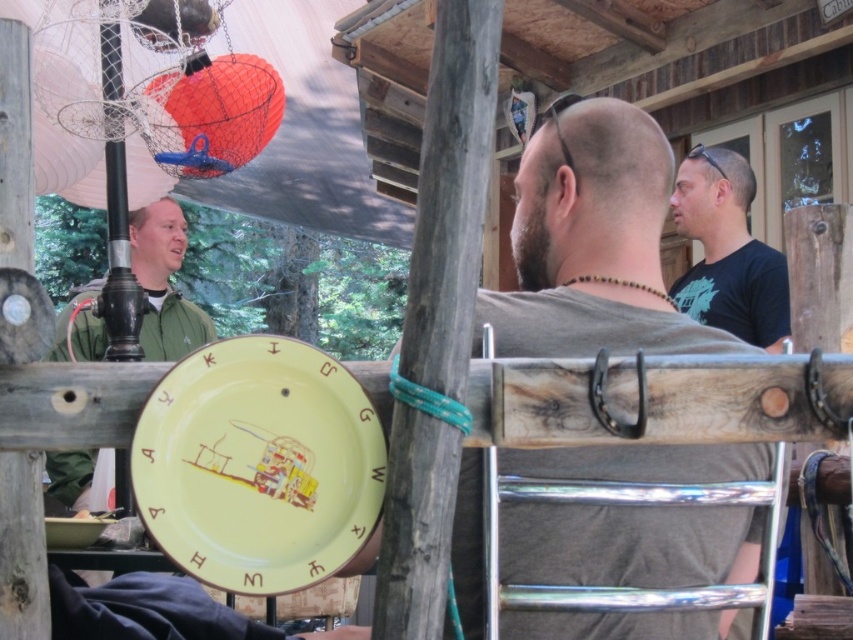
Can you confirm if black matte t-shirt at upper right is wider than green matte jacket at left?

No.

Which of these two, black matte t-shirt at upper right or green matte jacket at left, stands taller?

black matte t-shirt at upper right is taller.

You are a GUI agent. You are given a task and a screenshot of the screen. Output one action in this format:
    pyautogui.click(x=<x>, y=<y>)
    Task: Click on the black matte t-shirt at upper right
    This screenshot has height=640, width=853.
    Given the screenshot: What is the action you would take?
    pyautogui.click(x=727, y=252)

Between point (694, 352) and point (77, 522), which one is positioned behind?

The point (77, 522) is more distant.

Which is in front, point (552, 627) or point (86, 534)?

Positioned in front is point (552, 627).

Is point (523, 474) positioned in front of point (57, 545)?

Yes, it is.

The height and width of the screenshot is (640, 853). Identify the location of gray fabric shirt at center. click(x=590, y=243).

This screenshot has width=853, height=640. Describe the element at coordinates (258, 465) in the screenshot. I see `yellow ceramic plate at center` at that location.

Identify the location of yellow ceramic plate at center. This screenshot has width=853, height=640. (258, 465).